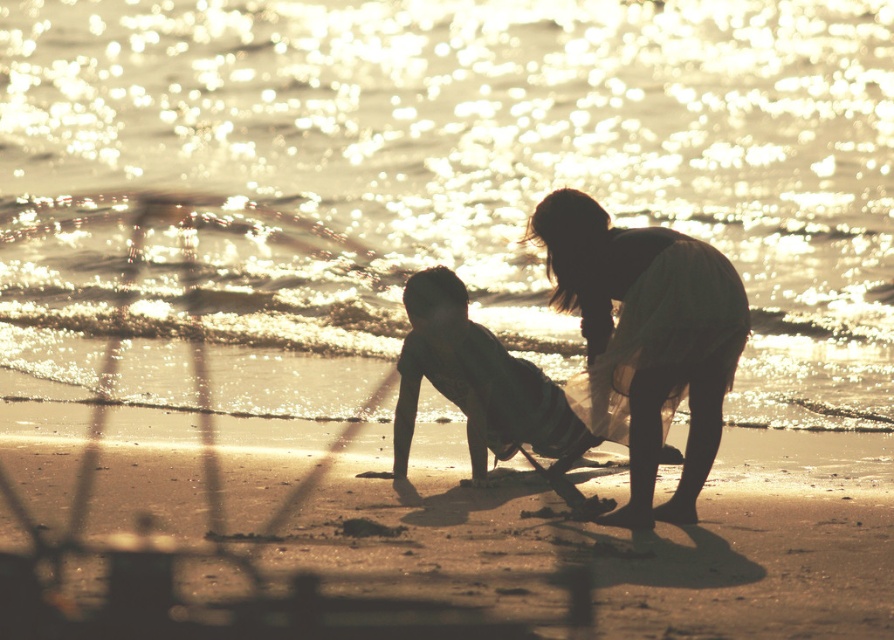
Measure the distance between sparkling golden water at center and silhouette skin child at center.

The distance of sparkling golden water at center from silhouette skin child at center is 15.38 feet.

Who is more forward, (149, 282) or (500, 392)?

Point (500, 392) is in front.

Between point (294, 17) and point (503, 369), which one is positioned behind?

Point (294, 17)

The image size is (894, 640). Identify the location of sparkling golden water at center. (437, 180).

Does sparkling golden water at center appear under smooth sand at lower center?

No.

Does point (198, 243) come in front of point (158, 596)?

No, it is not.

At what (x,y) coordinates should I click in order to perform the action: click on sparkling golden water at center. Please return your answer as a coordinate pair (x, y). This screenshot has width=894, height=640. Looking at the image, I should click on (437, 180).

Which of these two, sparkling golden water at center or silhouette dress at center, stands shorter?

silhouette dress at center is shorter.

Which is more to the right, sparkling golden water at center or silhouette dress at center?

From the viewer's perspective, silhouette dress at center appears more on the right side.

Is point (163, 356) in front of point (722, 264)?

No, (163, 356) is further to viewer.

The height and width of the screenshot is (640, 894). I want to click on sparkling golden water at center, so click(437, 180).